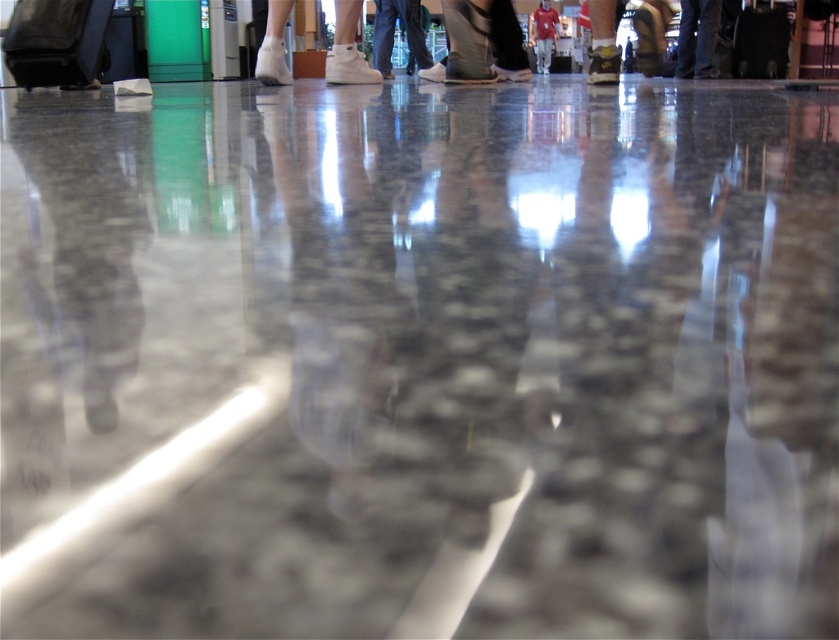
From the picture: Measure the distance between denim pants at center and camera.

4.80 meters

How far apart are denim pants at center and dark blue jeans at center?

They are 2.10 meters apart.

Between point (702, 35) and point (384, 49), which one is positioned behind?

The point (384, 49) is more distant.

This screenshot has height=640, width=839. What are the coordinates of `denim pants at center` in the screenshot? It's located at (697, 38).

Is denim pants at center positioned in front of matte red shirt at center?

Yes, denim pants at center is closer to the viewer.

Who is lower down, denim pants at center or matte red shirt at center?

denim pants at center is below.

This screenshot has height=640, width=839. I want to click on denim pants at center, so click(697, 38).

Can you confirm if black leather suitcase at center is positioned to the right of dark blue jeans at center?

Correct, you'll find black leather suitcase at center to the right of dark blue jeans at center.

This screenshot has width=839, height=640. Describe the element at coordinates (759, 42) in the screenshot. I see `black leather suitcase at center` at that location.

Between point (759, 42) and point (389, 13), which one is positioned behind?

The point (389, 13) is more distant.

Where is `black leather suitcase at center`? This screenshot has height=640, width=839. black leather suitcase at center is located at coordinates (759, 42).